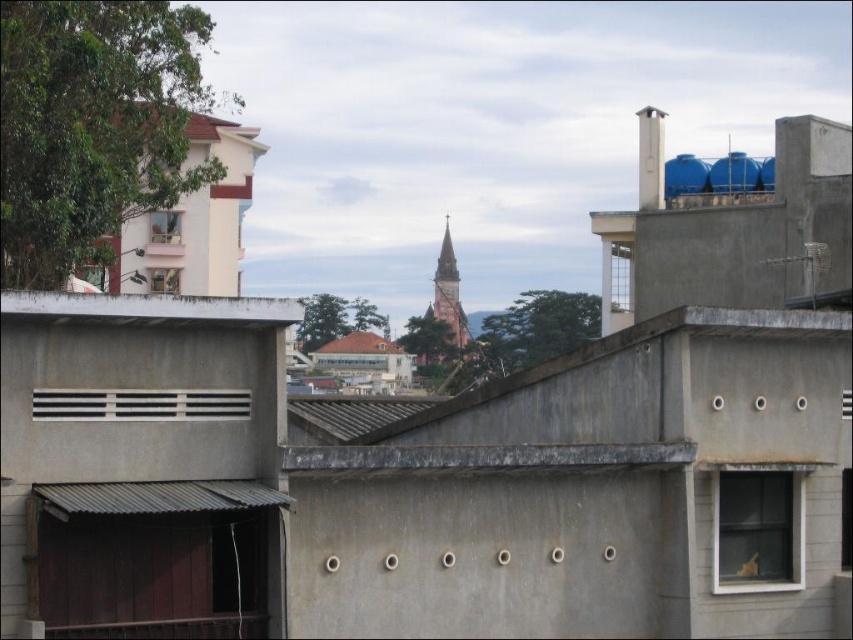
Is red brick church steeple at center shorter than matte white window at upper left?

No, red brick church steeple at center is not shorter than matte white window at upper left.

Can you confirm if red brick church steeple at center is bigger than matte white window at upper left?

Yes.

Which is behind, point (439, 292) or point (177, 236)?

The point (439, 292) is behind.

Where is `red brick church steeple at center`? red brick church steeple at center is located at coordinates (444, 308).

Is red brick church steeple at center positioned behind brown tiled roof at center?

Yes, red brick church steeple at center is behind brown tiled roof at center.

Measure the distance between red brick church steeple at center and camera.

red brick church steeple at center is 635.26 feet away from camera.

Measure the distance between red brick church steeple at center and camera.

They are 193.63 meters apart.

The image size is (853, 640). I want to click on red brick church steeple at center, so click(x=444, y=308).

Is red brick church steeple at center bigger than clear glass window at upper left?

Yes, red brick church steeple at center is bigger than clear glass window at upper left.

Does red brick church steeple at center lie in front of clear glass window at upper left?

That is False.

Is point (457, 308) positioned after point (171, 275)?

That is True.

Find the location of `red brick church steeple at center`. red brick church steeple at center is located at coordinates (444, 308).